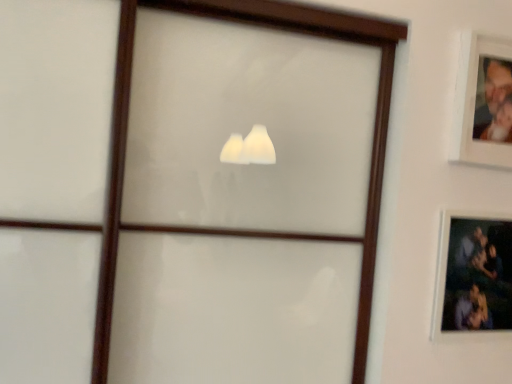
Question: Is white matte picture frame at upper right, which is the 1th picture frame from top to bottom, to the right of matte black picture frame at upper right, which ranks as the first picture frame in bottom-to-top order, from the viewer's perspective?

Choices:
 (A) no
 (B) yes

Answer: (B)

Question: Considering the relative sizes of white matte picture frame at upper right, marked as the second picture frame in a bottom-to-top arrangement, and matte black picture frame at upper right, which ranks as the first picture frame in bottom-to-top order, in the image provided, is white matte picture frame at upper right, marked as the second picture frame in a bottom-to-top arrangement, thinner than matte black picture frame at upper right, which ranks as the first picture frame in bottom-to-top order,?

Choices:
 (A) yes
 (B) no

Answer: (A)

Question: Can you confirm if white matte picture frame at upper right, which is the 1th picture frame from top to bottom, is shorter than matte black picture frame at upper right, the second picture frame from the top?

Choices:
 (A) yes
 (B) no

Answer: (A)

Question: Considering the relative sizes of white matte picture frame at upper right, which is the 1th picture frame from top to bottom, and matte black picture frame at upper right, which ranks as the first picture frame in bottom-to-top order, in the image provided, is white matte picture frame at upper right, which is the 1th picture frame from top to bottom, wider than matte black picture frame at upper right, which ranks as the first picture frame in bottom-to-top order,?

Choices:
 (A) yes
 (B) no

Answer: (B)

Question: From a real-world perspective, is white matte picture frame at upper right, marked as the second picture frame in a bottom-to-top arrangement, on matte black picture frame at upper right, the second picture frame from the top?

Choices:
 (A) no
 (B) yes

Answer: (B)

Question: Is white matte picture frame at upper right, which is the 1th picture frame from top to bottom, placed right next to matte black picture frame at upper right, which ranks as the first picture frame in bottom-to-top order?

Choices:
 (A) no
 (B) yes

Answer: (A)

Question: Does matte black picture frame at upper right, which ranks as the first picture frame in bottom-to-top order, come in front of white matte picture frame at upper right, which is the 1th picture frame from top to bottom?

Choices:
 (A) yes
 (B) no

Answer: (B)

Question: Is matte black picture frame at upper right, which ranks as the first picture frame in bottom-to-top order, facing towards white matte picture frame at upper right, which is the 1th picture frame from top to bottom?

Choices:
 (A) no
 (B) yes

Answer: (A)

Question: Considering the relative sizes of matte black picture frame at upper right, which ranks as the first picture frame in bottom-to-top order, and white matte picture frame at upper right, marked as the second picture frame in a bottom-to-top arrangement, in the image provided, is matte black picture frame at upper right, which ranks as the first picture frame in bottom-to-top order, shorter than white matte picture frame at upper right, marked as the second picture frame in a bottom-to-top arrangement,?

Choices:
 (A) no
 (B) yes

Answer: (A)

Question: Is white matte picture frame at upper right, which is the 1th picture frame from top to bottom, located within matte black picture frame at upper right, which ranks as the first picture frame in bottom-to-top order?

Choices:
 (A) yes
 (B) no

Answer: (B)

Question: Considering the relative sizes of matte black picture frame at upper right, which ranks as the first picture frame in bottom-to-top order, and white matte picture frame at upper right, which is the 1th picture frame from top to bottom, in the image provided, is matte black picture frame at upper right, which ranks as the first picture frame in bottom-to-top order, wider than white matte picture frame at upper right, which is the 1th picture frame from top to bottom,?

Choices:
 (A) yes
 (B) no

Answer: (A)

Question: Is matte black picture frame at upper right, which ranks as the first picture frame in bottom-to-top order, smaller than white matte picture frame at upper right, marked as the second picture frame in a bottom-to-top arrangement?

Choices:
 (A) no
 (B) yes

Answer: (A)

Question: Is white matte picture frame at upper right, which is the 1th picture frame from top to bottom, taller or shorter than matte black picture frame at upper right, the second picture frame from the top?

Choices:
 (A) tall
 (B) short

Answer: (B)